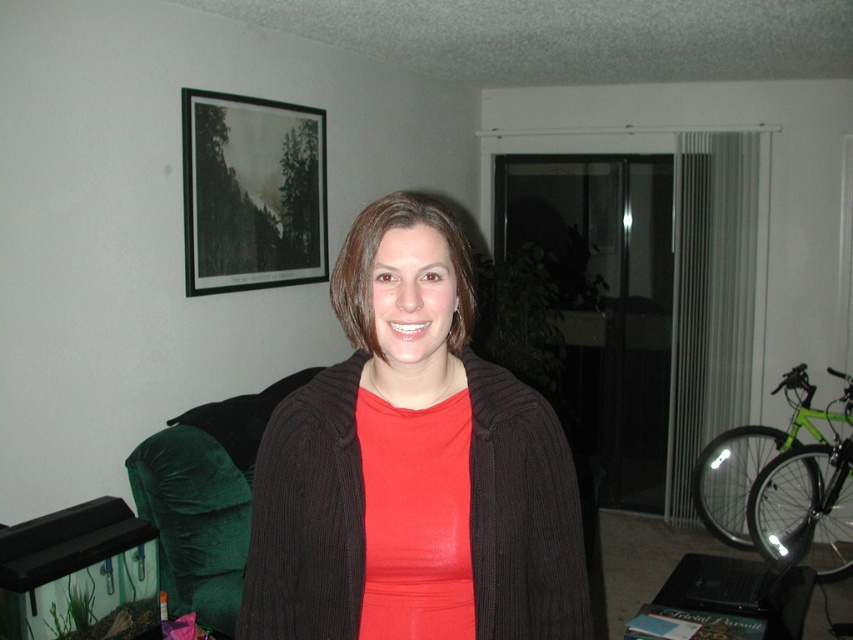
Describe the element at coordinates (251, 193) in the screenshot. This screenshot has width=853, height=640. I see `black matte picture frame at upper left` at that location.

Can you confirm if black matte picture frame at upper left is taller than velvet green armchair at left?

Yes.

Between point (317, 134) and point (164, 508), which one is positioned behind?

Positioned behind is point (317, 134).

Identify the location of black matte picture frame at upper left. (251, 193).

In order to click on matte black sweater at center in this screenshot , I will do `click(412, 467)`.

Does matte black sweater at center appear under black matte picture frame at upper left?

Yes.

Identify the location of matte black sweater at center. (412, 467).

Is matte black sweater at center wider than velvet green armchair at left?

Yes, matte black sweater at center is wider than velvet green armchair at left.

Between point (405, 227) and point (273, 388), which one is positioned behind?

Positioned behind is point (273, 388).

Who is more forward, [343,372] or [204,586]?

Point [343,372] is more forward.

This screenshot has height=640, width=853. I want to click on matte black sweater at center, so click(412, 467).